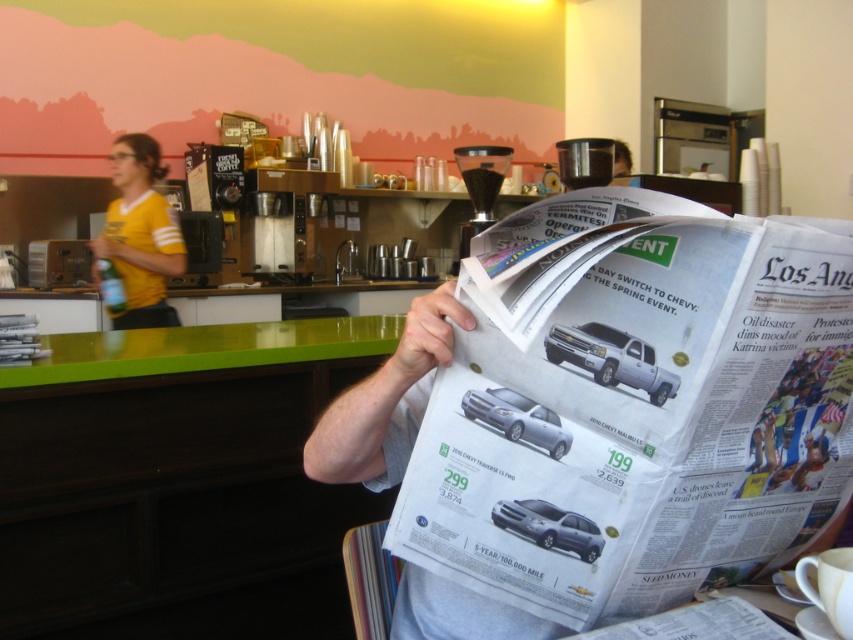
You are standing in the cafe and want to place a small plant between the two points, point (723,266) and point (155,321). Which point should the plant be closer to so it is in front of the other point?

The plant should be closer to point (723,266) because it is in front of point (155,321).

You are standing in the coffee shop and want to walk from point A to point B. Point A is at coordinate point[699,497] and point B is at coordinate point[627,156]. According to the scene description, which point is closer to you when facing the mural?

Point[699,497] is in front of point[627,156], so when facing the mural, point[699,497] is closer to you.